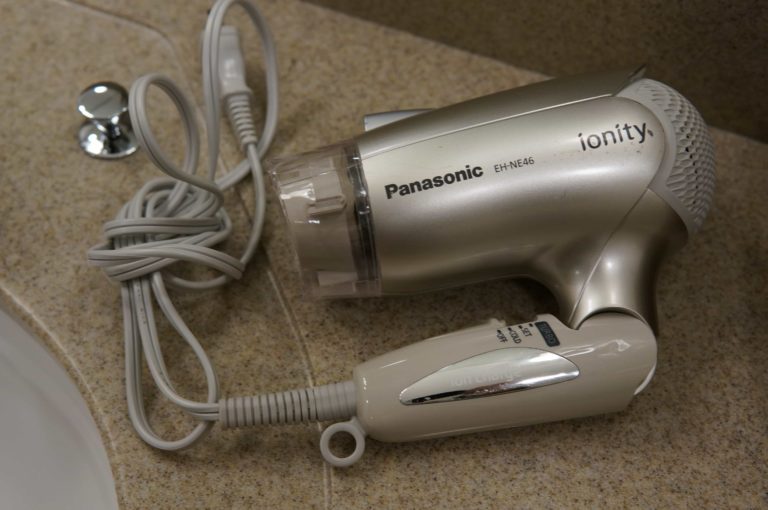
Where is `drain stopper device`? drain stopper device is located at coordinates (110, 122).